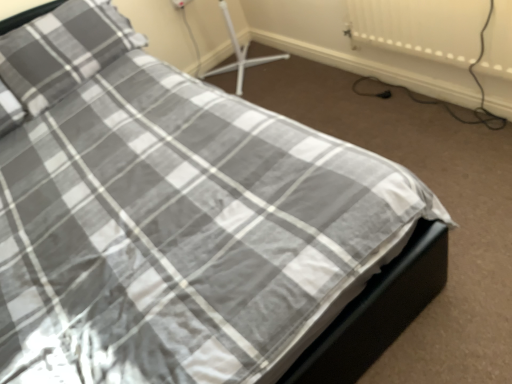
Question: Visually, is plaid fabric pillow at upper left positioned to the left or to the right of white textured radiator at upper right?

Choices:
 (A) right
 (B) left

Answer: (B)

Question: Is plaid fabric pillow at upper left spatially inside white textured radiator at upper right, or outside of it?

Choices:
 (A) inside
 (B) outside

Answer: (B)

Question: Does point (84, 49) appear closer or farther from the camera than point (438, 26)?

Choices:
 (A) farther
 (B) closer

Answer: (A)

Question: Considering the positions of white textured radiator at upper right and plaid fabric pillow at upper left in the image, is white textured radiator at upper right wider or thinner than plaid fabric pillow at upper left?

Choices:
 (A) thin
 (B) wide

Answer: (A)

Question: Based on their sizes in the image, would you say white textured radiator at upper right is bigger or smaller than plaid fabric pillow at upper left?

Choices:
 (A) small
 (B) big

Answer: (A)

Question: Visually, is white textured radiator at upper right positioned to the left or to the right of plaid fabric pillow at upper left?

Choices:
 (A) right
 (B) left

Answer: (A)

Question: Is white textured radiator at upper right situated inside plaid fabric pillow at upper left or outside?

Choices:
 (A) inside
 (B) outside

Answer: (B)